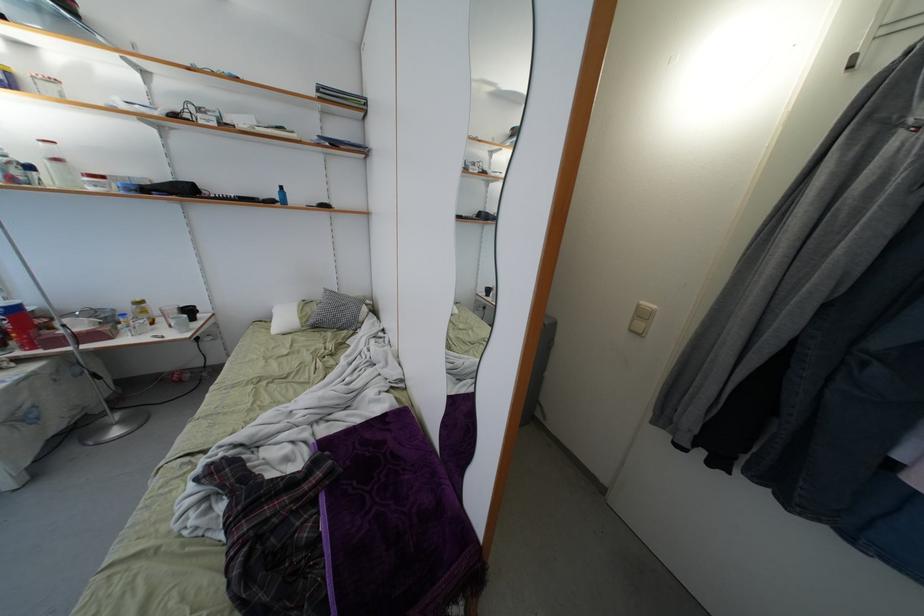
Identify the location of red and white container. The width and height of the screenshot is (924, 616). (94, 182).